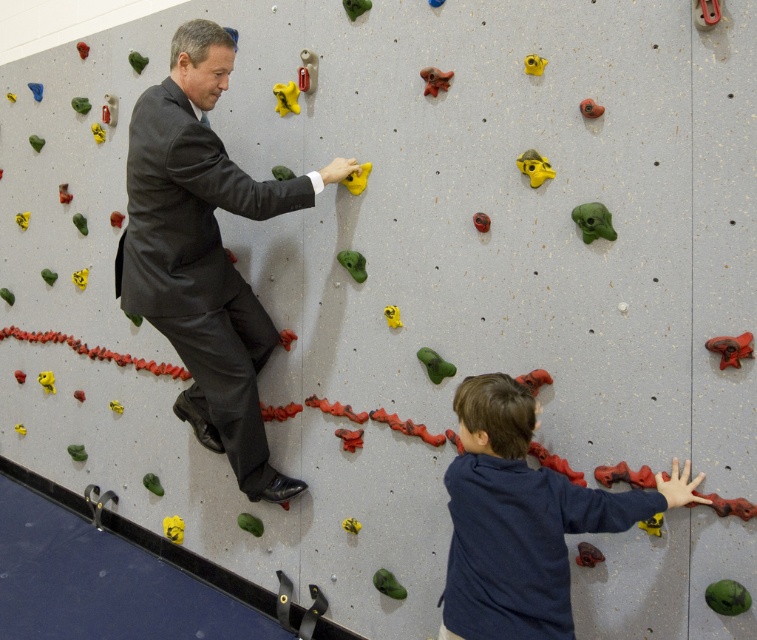
Question: Which point is farther to the camera?

Choices:
 (A) (519, 550)
 (B) (167, 112)

Answer: (B)

Question: In this image, where is dark gray suit at center located relative to dark blue sweater at lower right?

Choices:
 (A) right
 (B) left

Answer: (B)

Question: Is dark gray suit at center to the left of dark blue sweater at lower right from the viewer's perspective?

Choices:
 (A) yes
 (B) no

Answer: (A)

Question: Which point is closer to the camera taking this photo?

Choices:
 (A) (453, 490)
 (B) (203, 413)

Answer: (A)

Question: Can you confirm if dark gray suit at center is positioned below dark blue sweater at lower right?

Choices:
 (A) no
 (B) yes

Answer: (A)